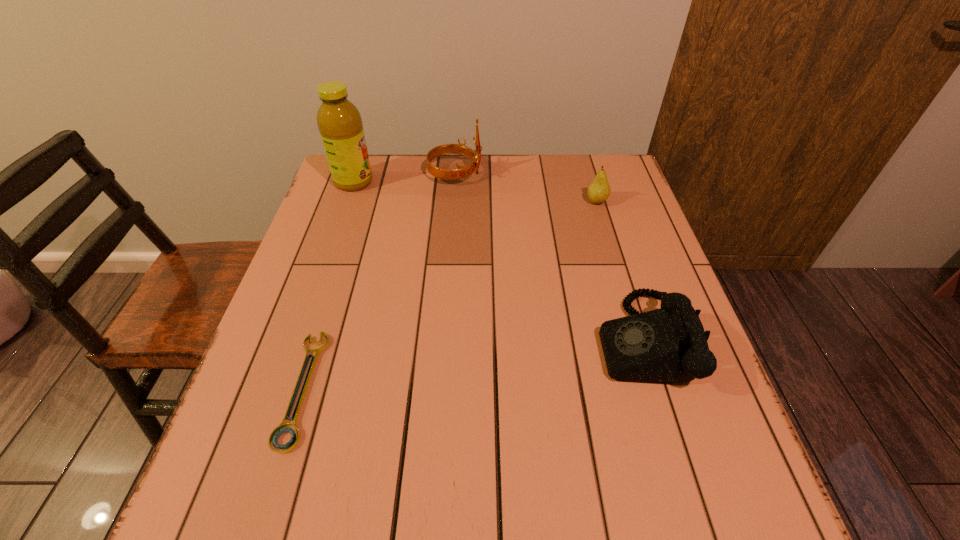
Locate an element on the screen. vacant point located on the dial of the telephone is located at coordinates click(556, 341).

Find the location of a particular element. This screenshot has width=960, height=540. vacant area situated 0.190m on the dial of the telephone is located at coordinates (508, 341).

Identify the location of free point located 0.200m on the back of the shortest object. The width and height of the screenshot is (960, 540). [340, 268].

Image resolution: width=960 pixels, height=540 pixels. Find the location of `fruit juice present at the far edge`. fruit juice present at the far edge is located at coordinates (339, 122).

You are a GUI agent. You are given a task and a screenshot of the screen. Output one action in this format:
    pyautogui.click(x=<x>, y=<y>)
    Task: Click on the tiara that is at the far edge
    This screenshot has width=960, height=540.
    Given the screenshot: What is the action you would take?
    pyautogui.click(x=447, y=174)

The height and width of the screenshot is (540, 960). I want to click on pear that is at the far edge, so click(x=599, y=190).

In order to click on fruit juice that is at the left edge in this screenshot , I will do `click(339, 122)`.

You are a GUI agent. You are given a task and a screenshot of the screen. Output one action in this format:
    pyautogui.click(x=<x>, y=<y>)
    Task: Click on the wrench located in the left edge section of the desktop
    This screenshot has width=960, height=540.
    Given the screenshot: What is the action you would take?
    pyautogui.click(x=284, y=427)

The image size is (960, 540). I want to click on pear that is at the right edge, so click(599, 190).

At what (x,y) coordinates should I click in order to perform the action: click on telephone situated at the right edge. Please return your answer as a coordinate pair (x, y). The height and width of the screenshot is (540, 960). Looking at the image, I should click on (668, 345).